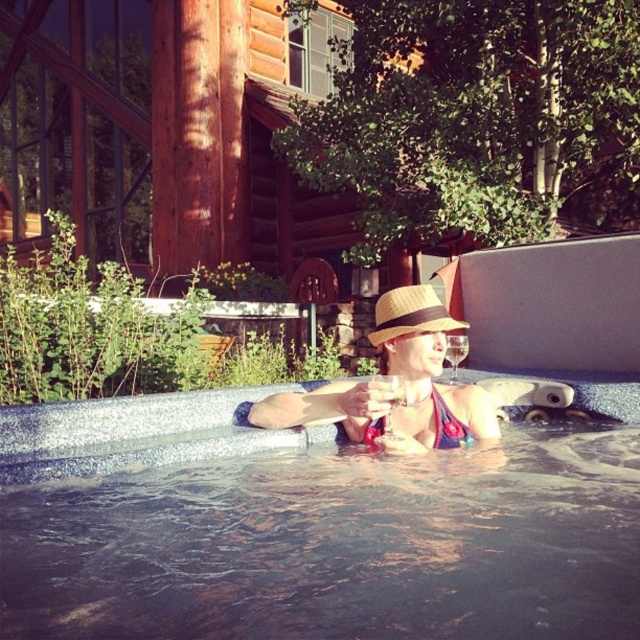
Between smooth concrete pool at center and straw hat at center, which one appears on the right side from the viewer's perspective?

straw hat at center

From the picture: Is smooth concrete pool at center positioned before straw hat at center?

Yes, smooth concrete pool at center is closer to the viewer.

What are the coordinates of `smooth concrete pool at center` in the screenshot? It's located at (314, 531).

Who is positioned more to the right, matte straw hat at center or straw hat at center?

straw hat at center

Is point (304, 400) more distant than point (433, 323)?

That is False.

This screenshot has width=640, height=640. I want to click on matte straw hat at center, so click(x=396, y=387).

How much distance is there between straw hat at center and blue textured bikini top at center?

A distance of 9.47 inches exists between straw hat at center and blue textured bikini top at center.

Between point (394, 326) and point (445, 448), which one is positioned in front?

Point (394, 326)

Where is `straw hat at center`? The image size is (640, 640). straw hat at center is located at coordinates (410, 314).